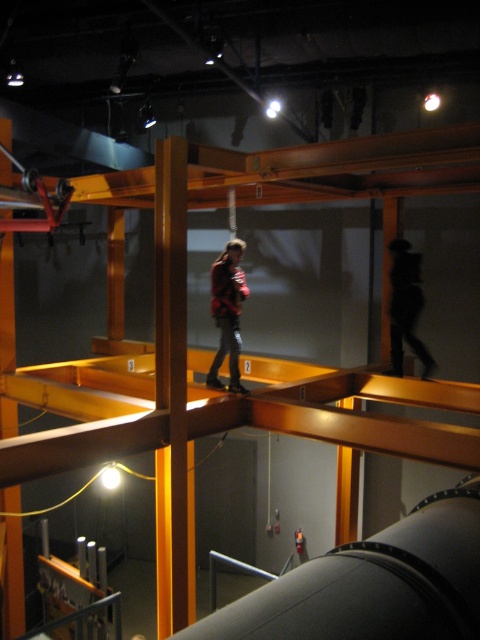
You are a security guard in the maze and need to locate the red plaid shirt at center and the black matte cat at upper center. Which object is closer to the ground?

The red plaid shirt at center is shorter than the black matte cat at upper center, so the red plaid shirt at center is closer to the ground.

You are designing a new exhibit and need to ensure that all displayed items are visible from the main pathway. The red plaid shirt at center and the black matte cat at upper center are two items in the exhibit. Which item requires more horizontal space to display properly?

The black matte cat at upper center requires more horizontal space because its width is greater than the red plaid shirt at center.

You are standing at the entrance of the maze and see two points marked in the maze structure. The first point is at coordinates point (213, 268) and the second point is at point (405, 285). Which point is closer to you?

Point (213, 268) is in front of point (405, 285), so it is closer to you.